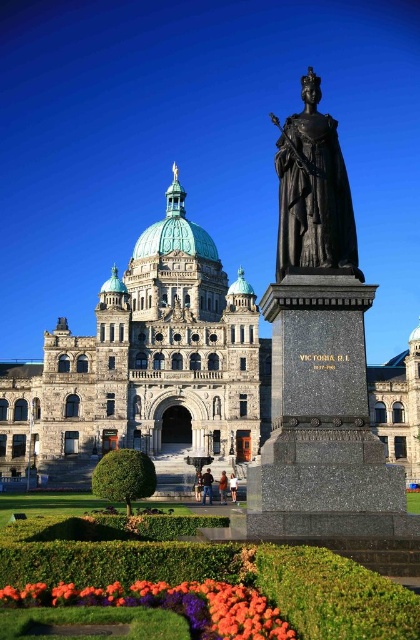
Question: From the image, what is the correct spatial relationship of black polished granite statue at center in relation to green copper dome at center?

Choices:
 (A) below
 (B) above

Answer: (B)

Question: Can you confirm if green grass at lower center is positioned above orange matte flowers at lower left?

Choices:
 (A) no
 (B) yes

Answer: (A)

Question: Which of the following is the closest to the observer?

Choices:
 (A) (189, 616)
 (B) (186, 240)

Answer: (A)

Question: Which object is closer to the camera taking this photo?

Choices:
 (A) green grass at lower center
 (B) green copper dome at center
 (C) orange matte flowers at lower left

Answer: (A)

Question: Estimate the real-world distances between objects in this image. Which object is closer to the green copper dome at center?

Choices:
 (A) stone building at center
 (B) green grass at lower center
 (C) orange matte flowers at lower left

Answer: (A)

Question: Can you confirm if green grass at lower center is thinner than green copper dome at center?

Choices:
 (A) yes
 (B) no

Answer: (B)